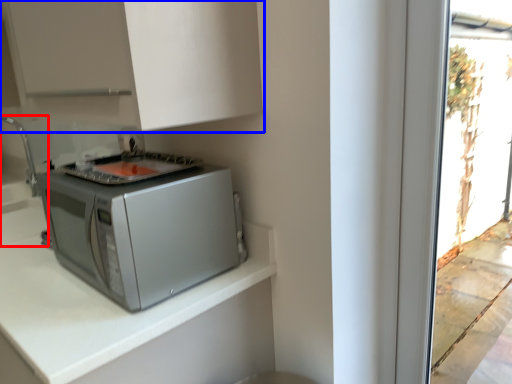
Question: Which object is closer to the camera taking this photo, sink (highlighted by a red box) or cabinetry (highlighted by a blue box)?

Choices:
 (A) sink
 (B) cabinetry

Answer: (B)